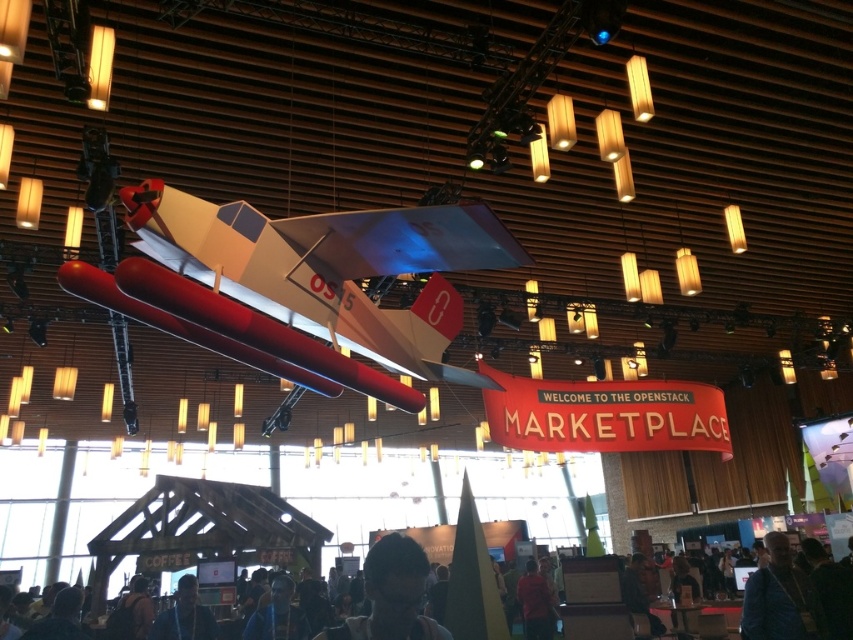
Is point (426, 358) farther from camera compared to point (199, 612)?

That is False.

Is matte white airplane at center behind dark blue shirt at lower center?

No, it is not.

The image size is (853, 640). I want to click on matte white airplane at center, so click(x=312, y=284).

Is dark hair at lower center thinner than dark blue shirt at lower center?

Correct, dark hair at lower center's width is less than dark blue shirt at lower center's.

The height and width of the screenshot is (640, 853). What do you see at coordinates (392, 595) in the screenshot?
I see `dark hair at lower center` at bounding box center [392, 595].

Is point (407, 589) closer to camera compared to point (167, 636)?

Yes, it is in front of point (167, 636).

Image resolution: width=853 pixels, height=640 pixels. I want to click on dark hair at lower center, so click(392, 595).

Can you confirm if blue fabric jacket at lower right is positioned above dark blue shirt at lower center?

Yes.

Is blue fabric jacket at lower right thinner than dark blue shirt at lower center?

No, blue fabric jacket at lower right is not thinner than dark blue shirt at lower center.

Where is `blue fabric jacket at lower right`? The height and width of the screenshot is (640, 853). blue fabric jacket at lower right is located at coordinates (776, 596).